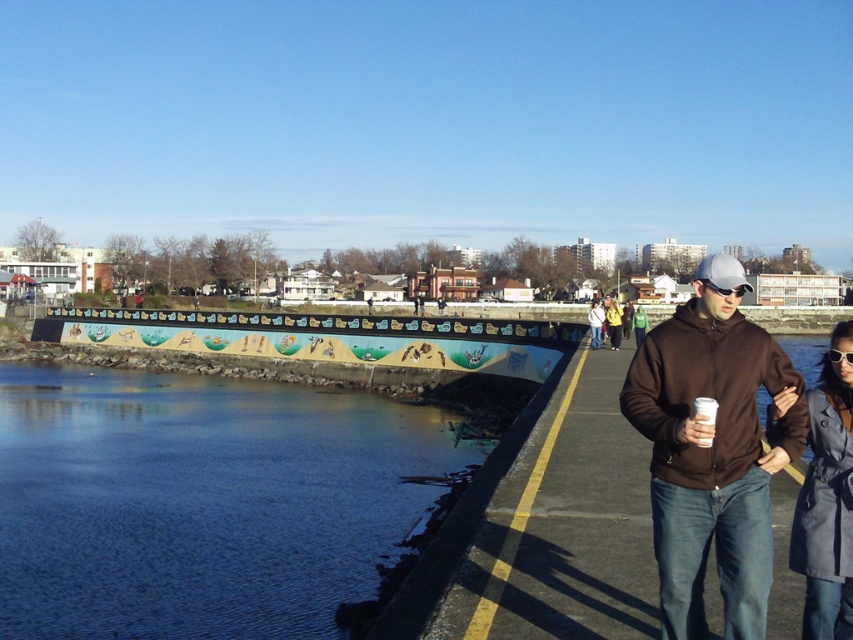
You are a photographer standing on the walkway and want to capture both the blue water at lower left and the brown matte jacket at center in a single frame. Which object will occupy more horizontal space in your photo?

The blue water at lower left will occupy more horizontal space in the photo because its width is larger than that of the brown matte jacket at center.

You are standing on the walkway and want to take a photo of the blue water at lower left. Where should you aim your camera to capture it?

You should aim your camera at point (202, 500) to capture the blue water at lower left.